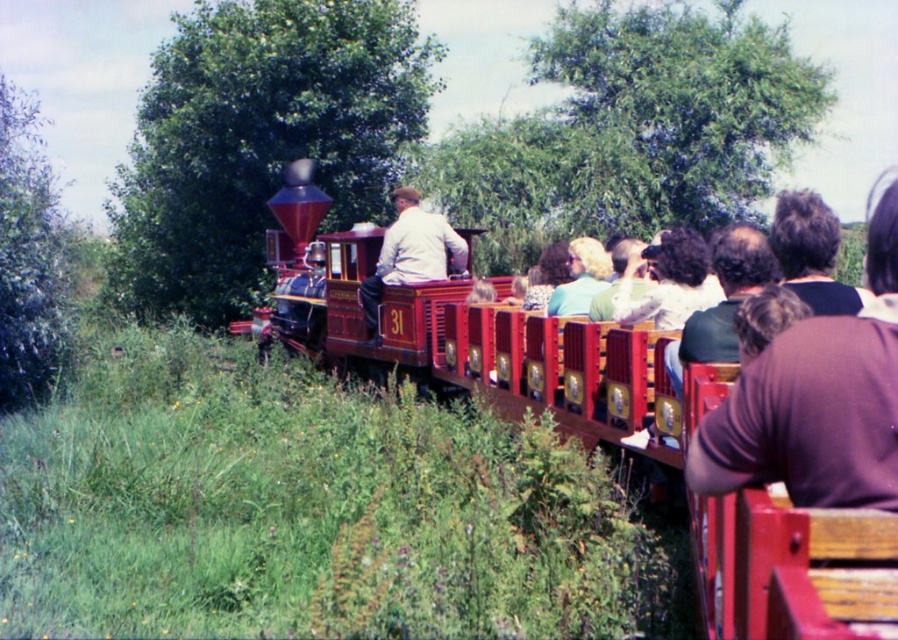
You are a passenger on the polished wood train at center and want to wave to the person wearing the brown fabric shirt at right. Can you see them from your current position?

The polished wood train at center is in front of the brown fabric shirt at right, so the person wearing the brown fabric shirt at right is behind the train. Therefore, you cannot see them from your current position on the polished wood train at center.

You are a photographer taking a picture of the passengers on the train. You notice two shirts in the scene, the brown fabric shirt at right and the matte white shirt at center. Which shirt takes up more area in your photo?

The matte white shirt at center takes up more area in the photo because the brown fabric shirt at right occupies less space than the matte white shirt at center.